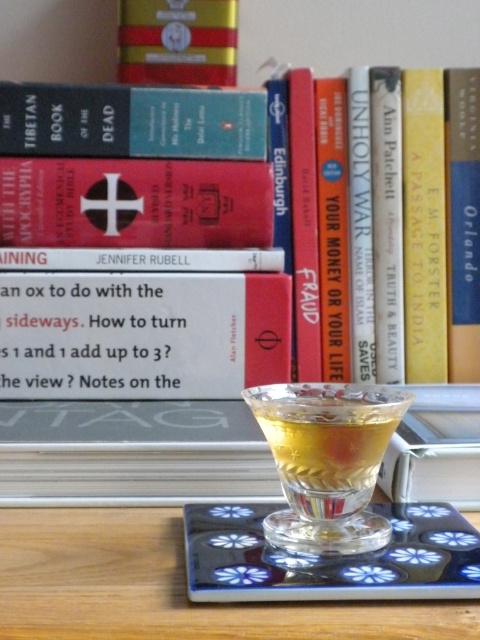
Which is more to the right, wooden table at center or matte red book at center?

From the viewer's perspective, wooden table at center appears more on the right side.

How much distance is there between wooden table at center and matte red book at center?

wooden table at center is 11.50 inches away from matte red book at center.

Between point (159, 536) and point (192, 221), which one is positioned behind?

The point (192, 221) is behind.

This screenshot has height=640, width=480. In order to click on wooden table at center in this screenshot , I will do `click(166, 588)`.

Which is below, matte red book at center or dark blue hardcover book at upper left?

matte red book at center is below.

Who is taller, matte red book at center or dark blue hardcover book at upper left?

matte red book at center is taller.

Does point (252, 179) lie in front of point (43, 129)?

No.

Find the location of a particular element. matte red book at center is located at coordinates (134, 202).

Locate an element on the screen. white paper book at center is located at coordinates (142, 333).

The image size is (480, 640). In order to click on white paper book at center in this screenshot , I will do `click(142, 333)`.